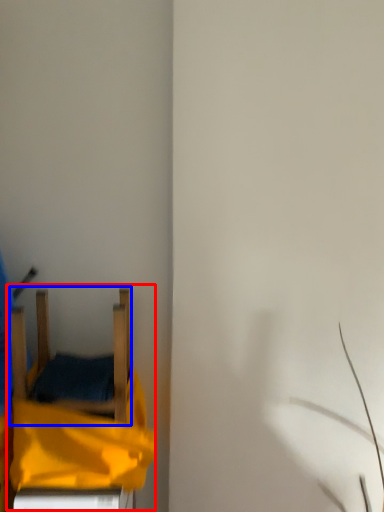
Question: Which object is further to the camera taking this photo, bed (highlighted by a red box) or furniture (highlighted by a blue box)?

Choices:
 (A) bed
 (B) furniture

Answer: (B)